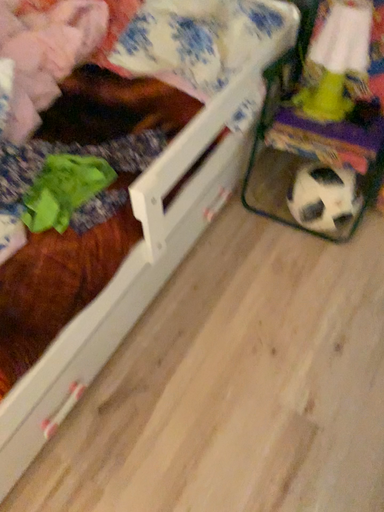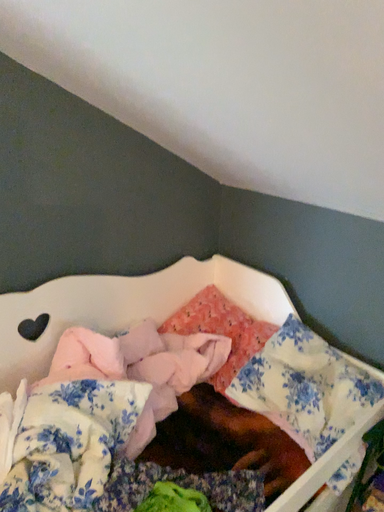
Question: How did the camera likely rotate when shooting the video?

Choices:
 (A) rotated left
 (B) rotated right

Answer: (A)